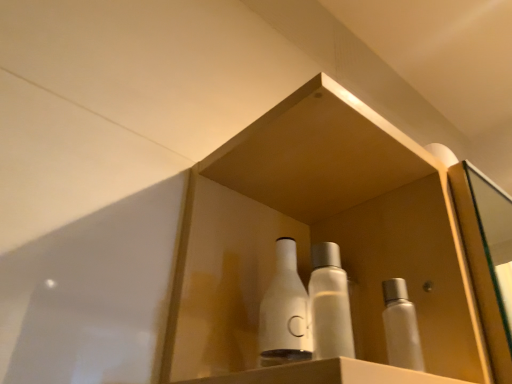
Question: Considering the positions of white glossy bottles at center and translucent plastic bottle at center, the second bottle positioned from the right, in the image, is white glossy bottles at center taller or shorter than translucent plastic bottle at center, the second bottle positioned from the right,?

Choices:
 (A) short
 (B) tall

Answer: (B)

Question: From the image's perspective, relative to translucent plastic bottle at center, the second bottle positioned from the right, is white glossy bottles at center above or below?

Choices:
 (A) above
 (B) below

Answer: (A)

Question: Considering the real-world distances, which object is closest to the white glossy bottles at center?

Choices:
 (A) translucent plastic bottle at center, the second bottle viewed from the left
 (B) white matte bottle at center, the third bottle positioned from the right
 (C) white matte bottle at right, which appears as the first bottle when viewed from the right

Answer: (B)

Question: Considering the real-world distances, which object is farthest from the white matte bottle at right, which appears as the first bottle when viewed from the right?

Choices:
 (A) translucent plastic bottle at center, the second bottle positioned from the right
 (B) white glossy bottles at center
 (C) white matte bottle at center, the third bottle positioned from the right

Answer: (B)